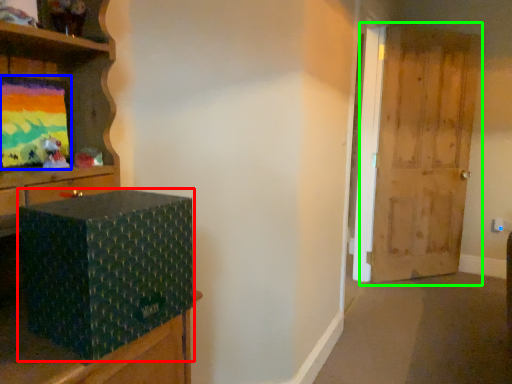
Question: Which is farther away from box (highlighted by a red box)? picture frame (highlighted by a blue box) or door (highlighted by a green box)?

Choices:
 (A) picture frame
 (B) door

Answer: (B)